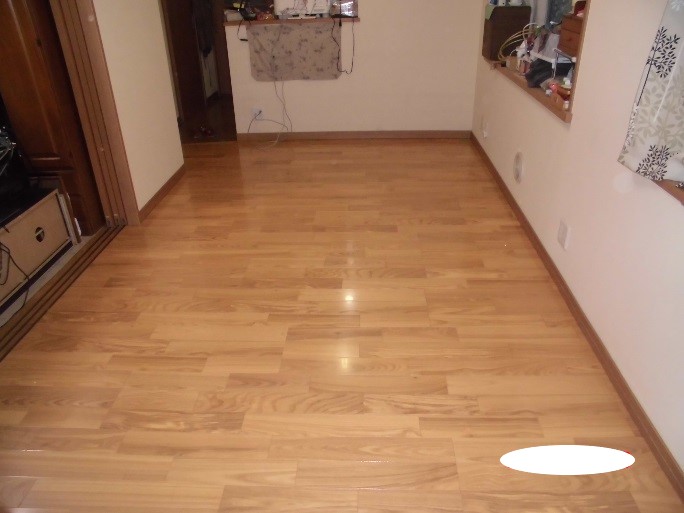
Locate an element on the screen. drawer is located at coordinates (44, 243).